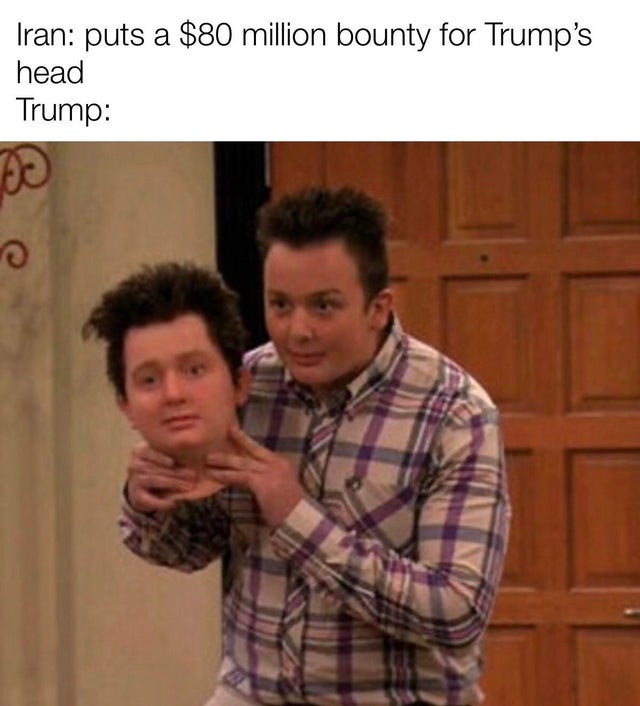
Find the location of a particular element. wall is located at coordinates (91, 472).